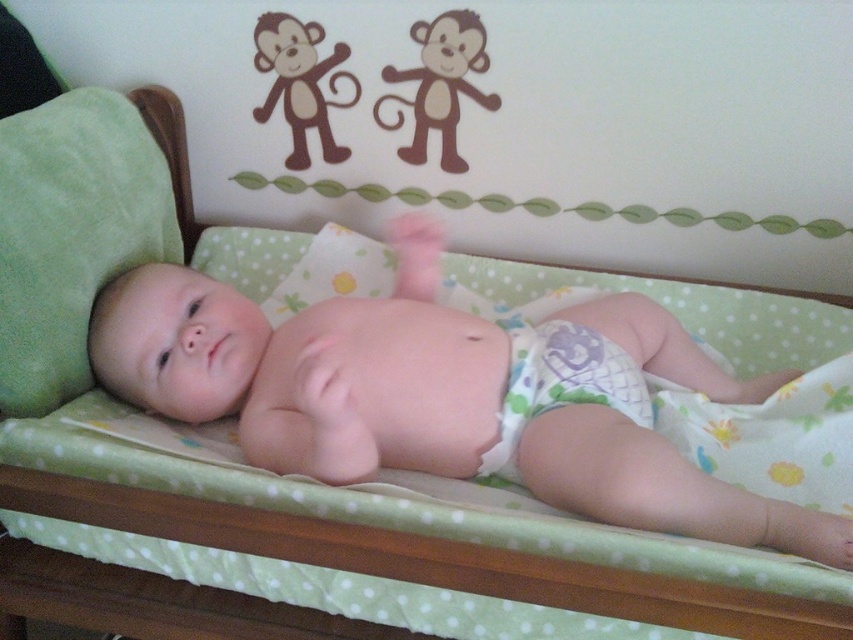
Who is positioned more to the left, smooth white diaper at center or printed fabric diaper at center?

From the viewer's perspective, smooth white diaper at center appears more on the left side.

Consider the image. Who is taller, smooth white diaper at center or printed fabric diaper at center?

smooth white diaper at center is taller.

Identify the location of smooth white diaper at center. The width and height of the screenshot is (853, 640). (447, 394).

Locate an element on the screen. smooth white diaper at center is located at coordinates [447, 394].